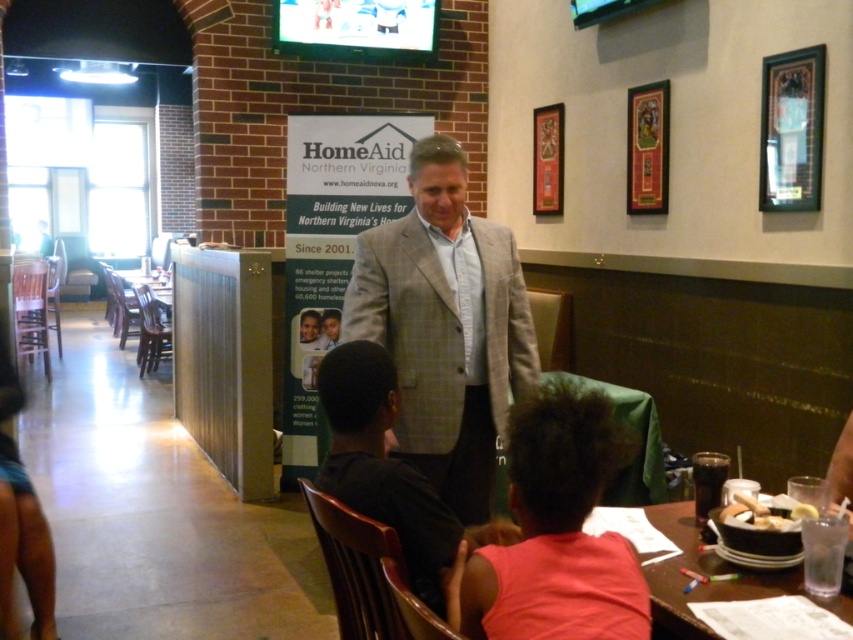
Question: Estimate the real-world distances between objects in this image. Which object is closer to the pink fabric at lower center?

Choices:
 (A) gray plaid suit at center
 (B) white bread at lower right

Answer: (B)

Question: Can you confirm if pink fabric at lower center is smaller than clear plastic table at lower right?

Choices:
 (A) yes
 (B) no

Answer: (B)

Question: Which point is closer to the camera?

Choices:
 (A) white bread at lower right
 (B) clear plastic table at lower right
 (C) pink fabric at lower center
 (D) gray plaid suit at center

Answer: (C)

Question: Observing the image, what is the correct spatial positioning of pink fabric at lower center in reference to clear plastic table at lower right?

Choices:
 (A) right
 (B) left

Answer: (B)

Question: Which point is closer to the camera?

Choices:
 (A) gray plaid suit at center
 (B) pink fabric at lower center

Answer: (B)

Question: Considering the relative positions of clear plastic table at lower right and white bread at lower right in the image provided, where is clear plastic table at lower right located with respect to white bread at lower right?

Choices:
 (A) below
 (B) above

Answer: (A)